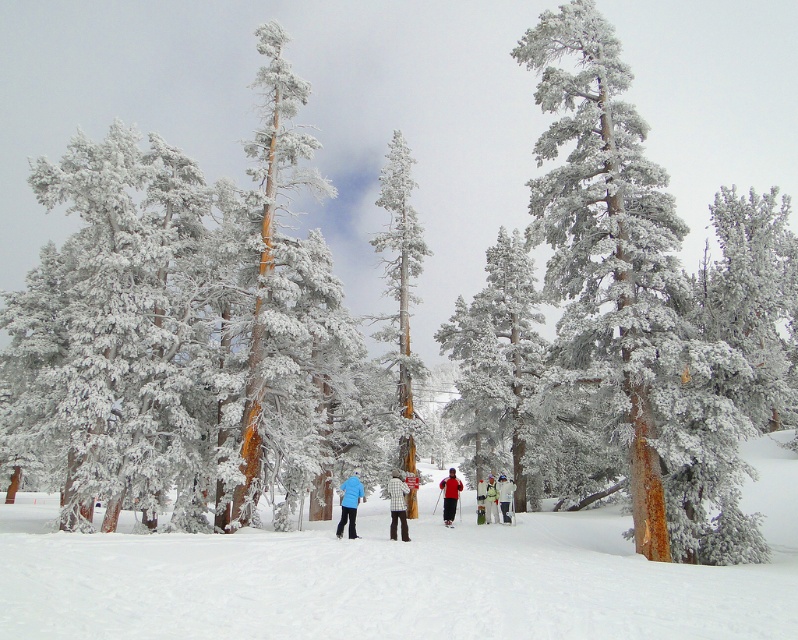
Does blue matte jacket at center have a larger size compared to white checkered shirt at center?

Correct, blue matte jacket at center is larger in size than white checkered shirt at center.

Can you confirm if blue matte jacket at center is positioned above white checkered shirt at center?

Yes, blue matte jacket at center is above white checkered shirt at center.

What do you see at coordinates (350, 502) in the screenshot? Image resolution: width=798 pixels, height=640 pixels. I see `blue matte jacket at center` at bounding box center [350, 502].

Locate an element on the screen. The width and height of the screenshot is (798, 640). blue matte jacket at center is located at coordinates (350, 502).

Does snow-covered pine tree at center appear on the left side of blue matte jacket at center?

In fact, snow-covered pine tree at center is to the right of blue matte jacket at center.

Between point (409, 264) and point (358, 500), which one is positioned in front?

Point (358, 500)

Which is in front, point (413, 472) or point (352, 486)?

Point (352, 486) is in front.

Locate an element on the screen. This screenshot has height=640, width=798. snow-covered pine tree at center is located at coordinates (401, 282).

Between white snowboarder at center and matte black ski at center, which one appears on the right side from the viewer's perspective?

white snowboarder at center

Is white snowboarder at center positioned behind matte black ski at center?

Yes, it is.

Is point (494, 520) less distant than point (448, 524)?

No, it is not.

The height and width of the screenshot is (640, 798). I want to click on white snowboarder at center, so click(x=490, y=500).